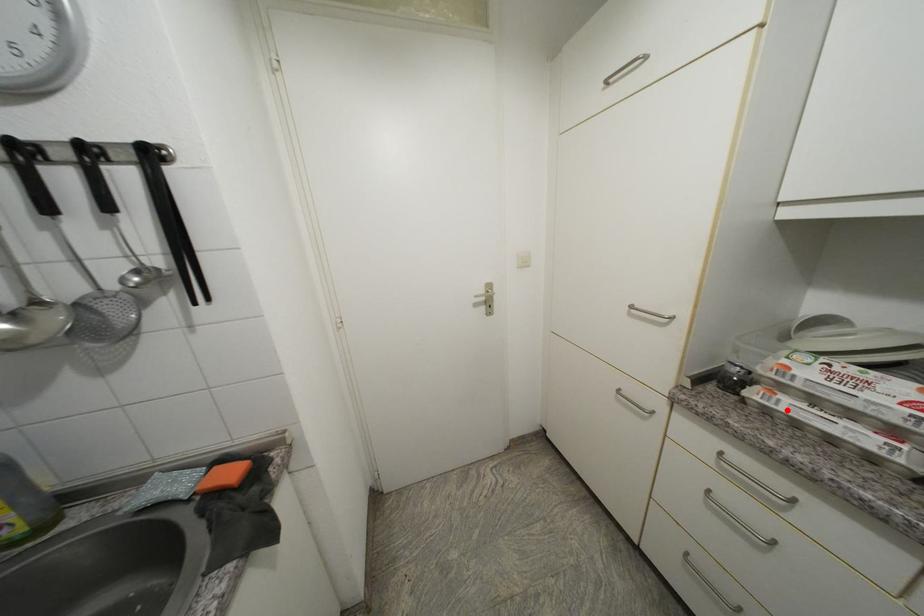
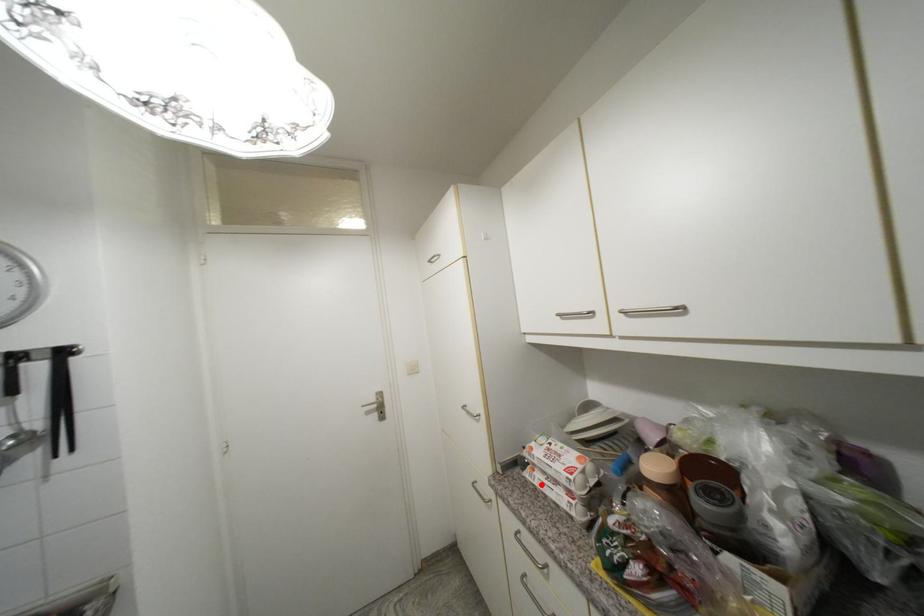
I am providing you with two images of the same scene from different viewpoints. A red point is marked on the first image and another point is marked on the second image. Do the highlighted points in image1 and image2 indicate the same real-world spot?

Yes